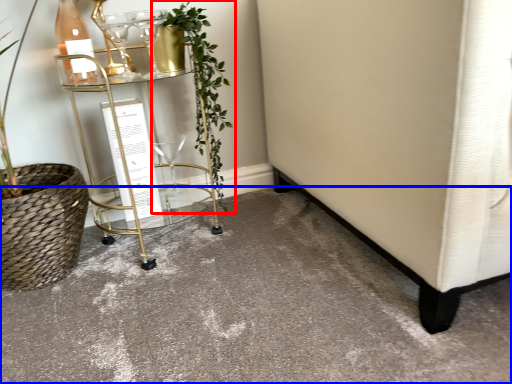
Question: Which object is further to the camera taking this photo, houseplant (highlighted by a red box) or concrete (highlighted by a blue box)?

Choices:
 (A) houseplant
 (B) concrete

Answer: (A)